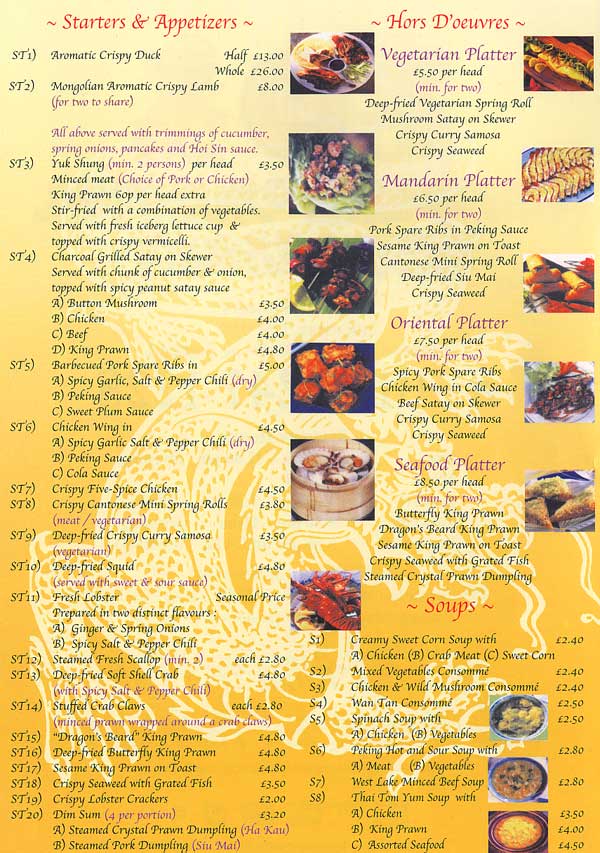
What are the coordinates of `mandarin platter` in the screenshot? It's located at (449, 196), (453, 212), (444, 229), (448, 246), (443, 258), (449, 274), (449, 294).